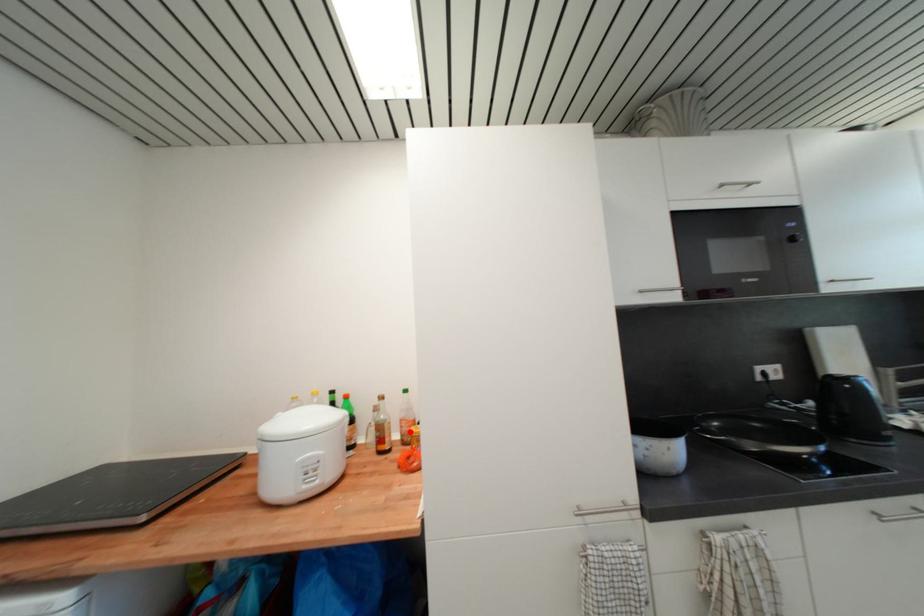
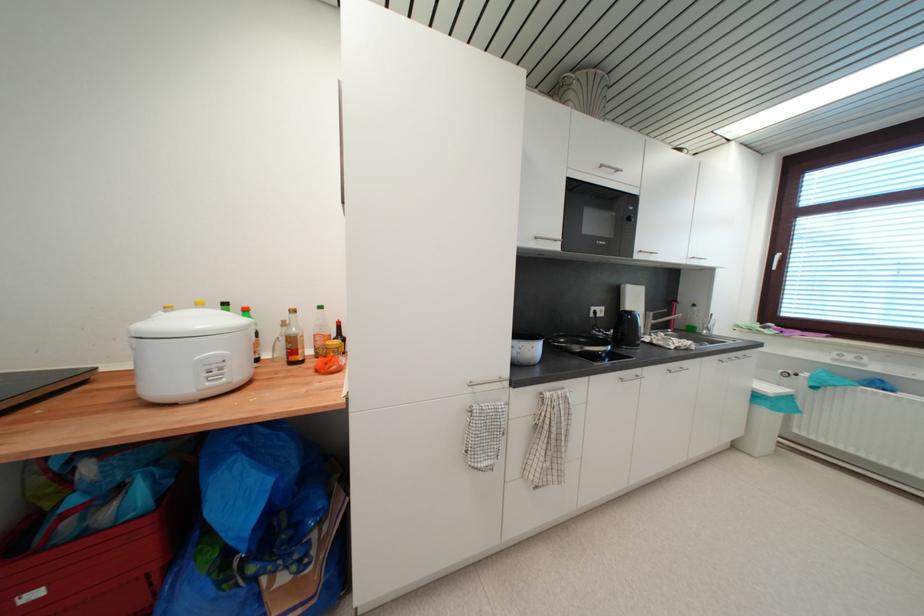
Question: I am providing you with two images of the same scene from different viewpoints. A red point is marked on the first image. Can you still see the location of the red point in image 2?

Choices:
 (A) Yes
 (B) No

Answer: (A)